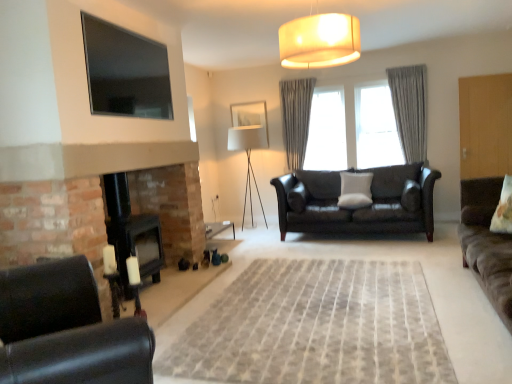
Question: Is white soft cushion at center, which ranks as the 1th pillow in left-to-right order, to the right of gray textured curtain at center, positioned as the second curtain in right-to-left order, from the viewer's perspective?

Choices:
 (A) yes
 (B) no

Answer: (A)

Question: Is white soft cushion at center, which ranks as the 1th pillow in left-to-right order, touching gray textured curtain at center, positioned as the second curtain in right-to-left order?

Choices:
 (A) no
 (B) yes

Answer: (A)

Question: Does white soft cushion at center, the second pillow in the front-to-back sequence, have a greater height compared to gray textured curtain at center, which appears as the 1th curtain when viewed from the left?

Choices:
 (A) yes
 (B) no

Answer: (B)

Question: Does white soft cushion at center, the second pillow in the front-to-back sequence, have a greater width compared to gray textured curtain at center, which appears as the 1th curtain when viewed from the left?

Choices:
 (A) no
 (B) yes

Answer: (A)

Question: Can you confirm if white soft cushion at center, which ranks as the 1th pillow in left-to-right order, is bigger than gray textured curtain at center, which appears as the 1th curtain when viewed from the left?

Choices:
 (A) yes
 (B) no

Answer: (B)

Question: From the image's perspective, is white soft cushion at center, which ranks as the 1th pillow in left-to-right order, on gray textured curtain at center, which appears as the 1th curtain when viewed from the left?

Choices:
 (A) yes
 (B) no

Answer: (B)

Question: From a real-world perspective, is light beige curtains at center located beneath gray textured curtain at center, which appears as the 1th curtain when viewed from the left?

Choices:
 (A) no
 (B) yes

Answer: (A)

Question: Is light beige curtains at center far from gray textured curtain at center, positioned as the second curtain in right-to-left order?

Choices:
 (A) yes
 (B) no

Answer: (B)

Question: Is light beige curtains at center wider than gray textured curtain at center, positioned as the second curtain in right-to-left order?

Choices:
 (A) yes
 (B) no

Answer: (A)

Question: Is light beige curtains at center directly adjacent to gray textured curtain at center, which appears as the 1th curtain when viewed from the left?

Choices:
 (A) no
 (B) yes

Answer: (A)

Question: From the image's perspective, does light beige curtains at center appear lower than gray textured curtain at center, which appears as the 1th curtain when viewed from the left?

Choices:
 (A) no
 (B) yes

Answer: (A)

Question: From a real-world perspective, is light beige curtains at center physically above gray textured curtain at center, which appears as the 1th curtain when viewed from the left?

Choices:
 (A) no
 (B) yes

Answer: (B)

Question: Does flat-screen tv at upper left appear on the left side of matte beige lampshade at upper center?

Choices:
 (A) yes
 (B) no

Answer: (A)